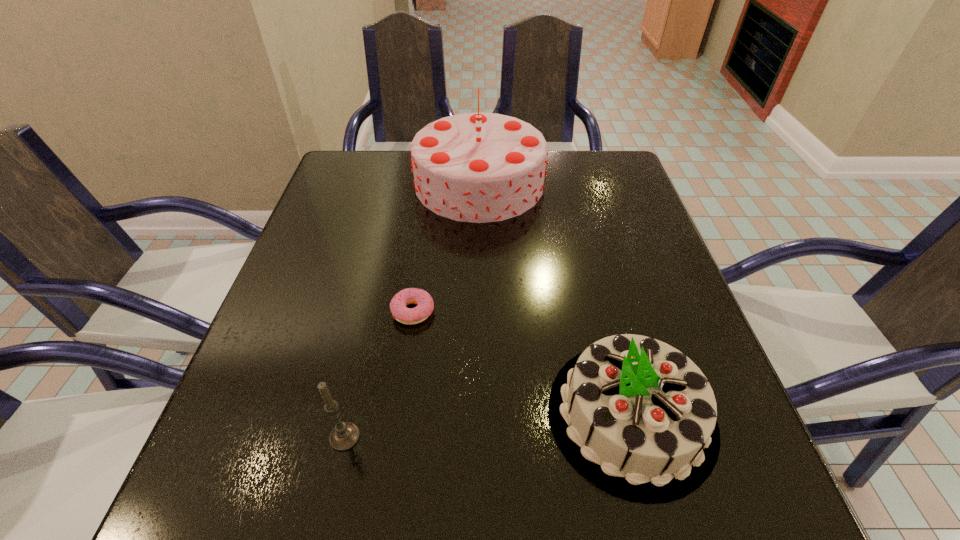
Image resolution: width=960 pixels, height=540 pixels. Identify the location of vacant region between the third tallest object and the doughnut. (379, 374).

Where is `blank region between the second farthest object and the shorter birthday cake`? The width and height of the screenshot is (960, 540). blank region between the second farthest object and the shorter birthday cake is located at coordinates (522, 363).

Identify the location of free space between the farthest object and the shortest object. This screenshot has height=540, width=960. (445, 247).

Identify the location of vacant space that is in between the leftmost object and the shorter birthday cake. This screenshot has height=540, width=960. (488, 426).

Locate an element on the screen. This screenshot has height=540, width=960. vacant area that lies between the third tallest object and the shortest object is located at coordinates (379, 374).

Find the location of a particular element. empty location between the nearer birthday cake and the doughnut is located at coordinates (522, 363).

Locate an element on the screen. vacant space that is in between the nearer birthday cake and the tallest object is located at coordinates (555, 299).

Where is `object that is the third closest one to the farthest object`? The height and width of the screenshot is (540, 960). object that is the third closest one to the farthest object is located at coordinates [x=345, y=435].

Identify which object is the closest to the nearer birthday cake. Please provide its 2D coordinates. Your answer should be formatted as a tuple, i.e. [(x, y)], where the tuple contains the x and y coordinates of a point satisfying the conditions above.

[(425, 305)]

The height and width of the screenshot is (540, 960). I want to click on blank space that satisfies the following two spatial constraints: 1. on the back side of the shortest object; 2. on the right side of the leftmost object, so click(372, 312).